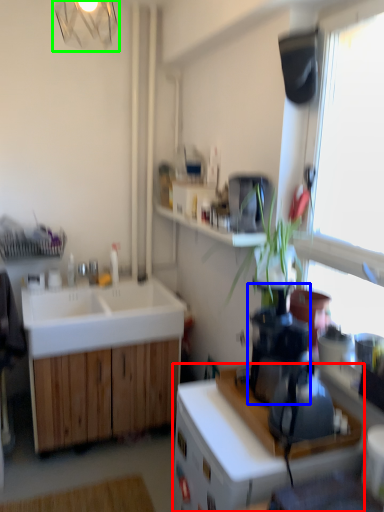
Question: Which object is positioned farthest from cabinetry (highlighted by a red box)? Select from coffee machine (highlighted by a blue box) and light fixture (highlighted by a green box).

Choices:
 (A) coffee machine
 (B) light fixture

Answer: (B)